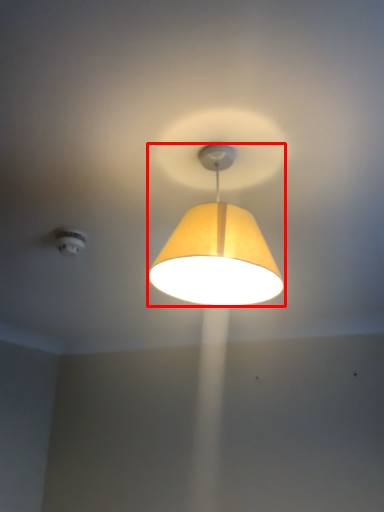
Question: Considering the relative positions of lamp (annotated by the red box) and lighting in the image provided, where is lamp (annotated by the red box) located with respect to the staircase?

Choices:
 (A) right
 (B) left

Answer: (A)